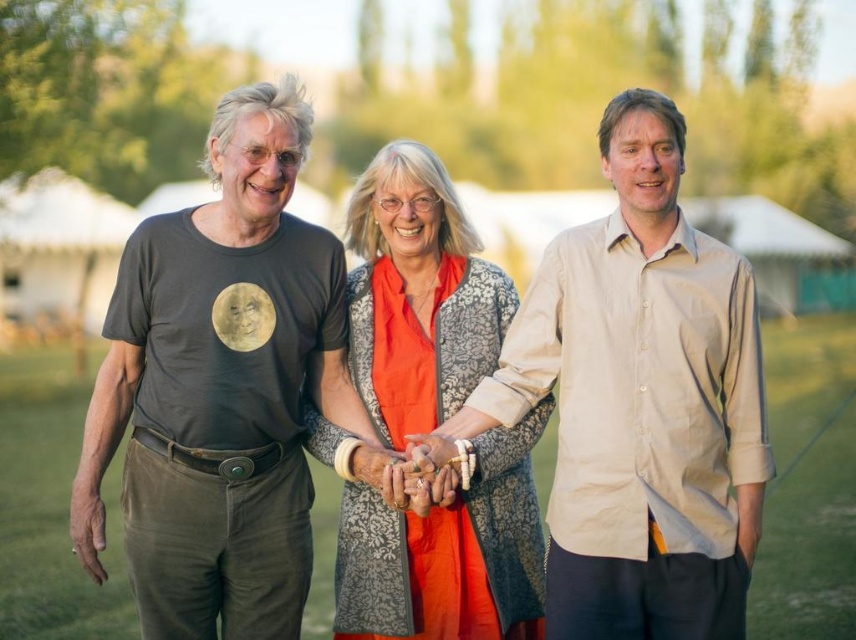
You are a photographer adjusting your camera settings to focus on the beige cotton shirt at center in the image. The camera has a focus point at coordinate point (x=640, y=403). Is this focus point correctly positioned over the beige cotton shirt at center?

Yes, the focus point at coordinate point (x=640, y=403) is correctly positioned over the beige cotton shirt at center as indicated in the description.

In the scene shown: You are a photographer trying to capture a group photo of the three people in the park. You want to ensure that the dark gray t shirt at center is positioned exactly at the center of the image. Given that the coordinate system starts at the bottom left corner of the image, with x increasing to the right and y increasing upwards, is the point at coordinate (x=220, y=387) the correct position for the dark gray t shirt at center?

Yes, the point at coordinate (x=220, y=387) corresponds to the dark gray t shirt at center, so positioning it there would place it correctly at the center of the image.